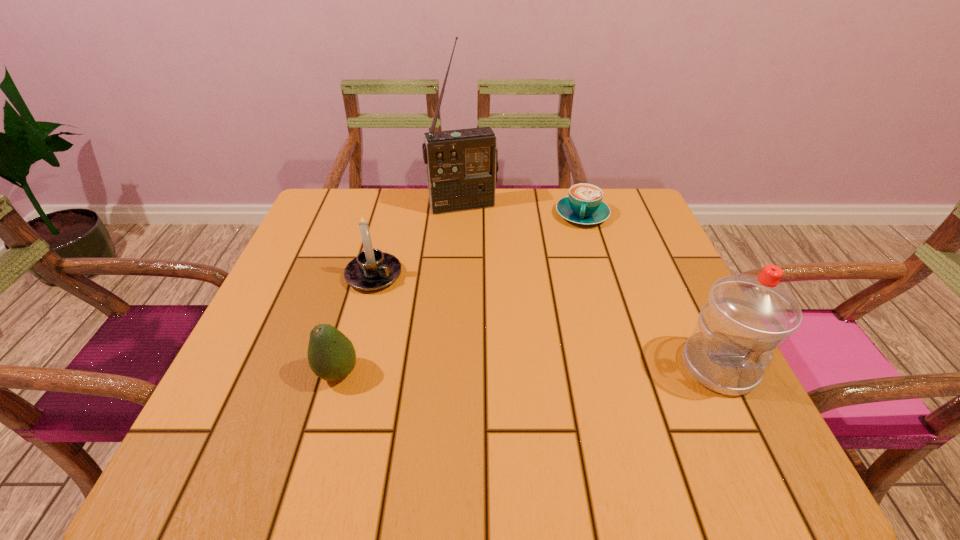
Find the location of a particular element. Image resolution: width=960 pixels, height=540 pixels. vacant area at the far edge of the desktop is located at coordinates (x=538, y=215).

Image resolution: width=960 pixels, height=540 pixels. Find the location of `vacant space at the near edge of the desktop`. vacant space at the near edge of the desktop is located at coordinates (564, 393).

Identify the location of free space at the left edge of the desktop. pyautogui.click(x=303, y=329).

The image size is (960, 540). In the image, there is a desktop. Identify the location of vacant space at the right edge. (607, 253).

What are the coordinates of `vacant space at the far left corner of the desktop` in the screenshot? It's located at (349, 225).

Where is `vacant space at the far right corner of the desktop`? The image size is (960, 540). vacant space at the far right corner of the desktop is located at coordinates (623, 195).

At what (x,y) coordinates should I click in order to perform the action: click on free space between the third tallest object and the shortest object. Please return your answer as a coordinate pair (x, y). The width and height of the screenshot is (960, 540). Looking at the image, I should click on (478, 245).

Where is `vacant space that is in between the rightmost object and the shortest object`? This screenshot has width=960, height=540. vacant space that is in between the rightmost object and the shortest object is located at coordinates (651, 291).

Find the location of `blank region between the third object from right to left and the candle holder`. blank region between the third object from right to left and the candle holder is located at coordinates (419, 240).

Where is `free space between the cappuccino and the water bottle`? free space between the cappuccino and the water bottle is located at coordinates pyautogui.click(x=651, y=291).